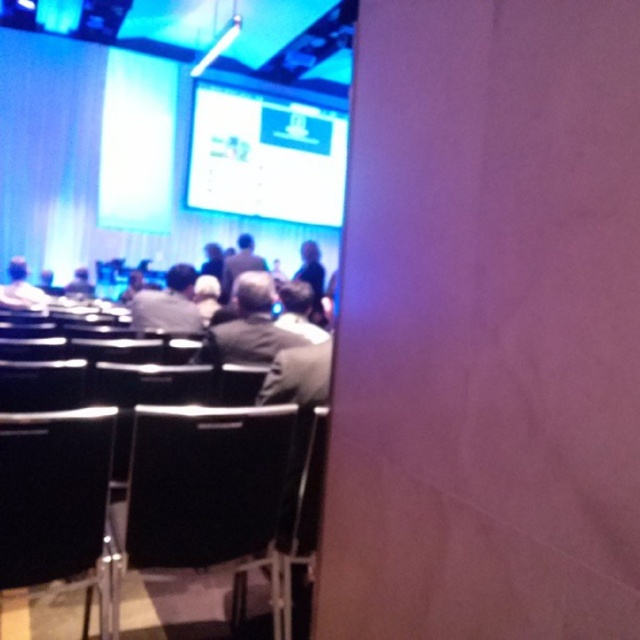
Does matte white screen at upper center come behind dark gray fabric jacket at center?

Yes.

Is matte white screen at upper center taller than dark gray fabric jacket at center?

Yes, matte white screen at upper center is taller than dark gray fabric jacket at center.

Measure the distance between point (246, 147) and camera.

A distance of 11.93 meters exists between point (246, 147) and camera.

Identify the location of matte white screen at upper center. The width and height of the screenshot is (640, 640). (266, 156).

Is black plastic chair at lower left above gray fabric jacket at left?

No.

Can you confirm if black plastic chair at lower left is positioned below gray fabric jacket at left?

Indeed, black plastic chair at lower left is positioned under gray fabric jacket at left.

Does point (97, 483) come closer to viewer compared to point (6, 284)?

Yes.

Locate an element on the screen. The height and width of the screenshot is (640, 640). black plastic chair at lower left is located at coordinates (54, 500).

Does black plastic chair at lower left have a larger size compared to gray fabric jacket at center?

No.

Which is more to the right, black plastic chair at lower left or gray fabric jacket at center?

black plastic chair at lower left is more to the right.

Identify the location of black plastic chair at lower left. (54, 500).